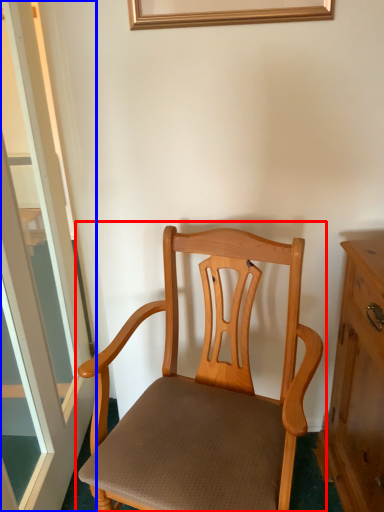
Question: Which object is further to the camera taking this photo, chair (highlighted by a red box) or window (highlighted by a blue box)?

Choices:
 (A) chair
 (B) window

Answer: (A)